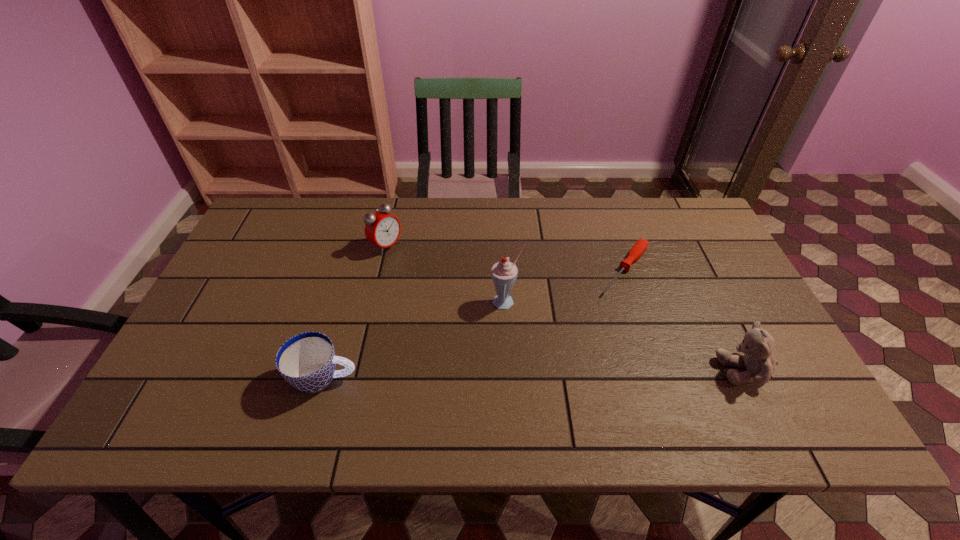
The height and width of the screenshot is (540, 960). I want to click on object located in the far edge section of the desktop, so click(383, 229).

Where is `cup that is at the near edge`? cup that is at the near edge is located at coordinates (307, 361).

You are a GUI agent. You are given a task and a screenshot of the screen. Output one action in this format:
    pyautogui.click(x=<x>, y=<y>)
    Task: Click on the teddy bear present at the near edge
    The width and height of the screenshot is (960, 540).
    Given the screenshot: What is the action you would take?
    pyautogui.click(x=757, y=346)

Find the location of a particular element. The image size is (960, 540). object positioned at the right edge is located at coordinates (757, 346).

The width and height of the screenshot is (960, 540). I want to click on object situated at the near right corner, so click(x=757, y=346).

Locate an element on the screen. This screenshot has height=540, width=960. vacant space at the far edge of the desktop is located at coordinates (427, 219).

I want to click on vacant area at the near edge of the desktop, so click(x=262, y=377).

In the image, there is a desktop. Find the location of `blank space at the left edge`. blank space at the left edge is located at coordinates (238, 251).

Locate an element on the screen. free location at the right edge is located at coordinates (690, 298).

At what (x,y) coordinates should I click in order to perform the action: click on vacant space at the far left corner of the desktop. Please return your answer as a coordinate pair (x, y). Looking at the image, I should click on (304, 219).